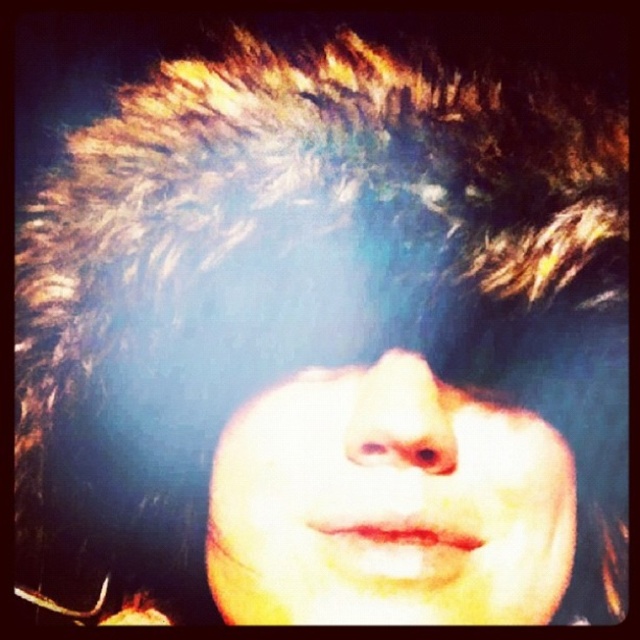
Looking at the person in the image, which object is larger between the smooth skin face at center and the brown matte eye at center?

The smooth skin face at center is bigger than the brown matte eye at center.

You are a photographer adjusting your camera settings for a portrait. The subject has a smooth skin face at center. If your camera requires the subject to be at least 12 inches away for optimal focus, will you need to adjust your distance?

The smooth skin face at center is 11.75 inches away from the viewer, which is less than the required 12 inches. Therefore, you should move back slightly to ensure optimal focus.